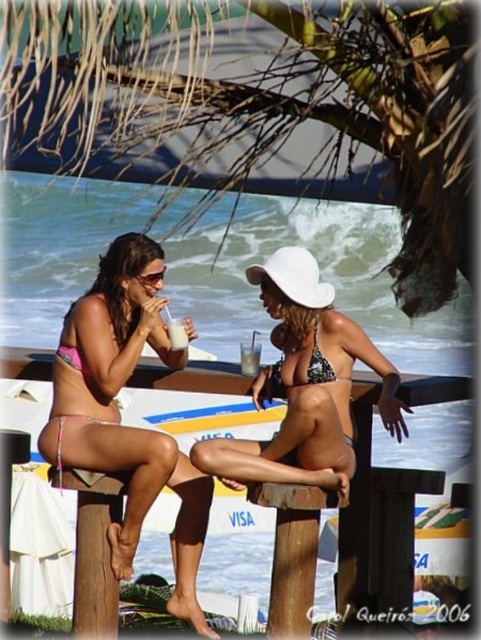
You are standing at the beach and want to place a small flag exactly halfway between point (318, 282) and point (177, 342). Which direction should you walk from the closer point to reach the halfway point?

Since point (318, 282) is closer to the viewer than point (177, 342), you should walk towards the direction of point (177, 342) to reach the halfway point between them.

You are a photographer at the beach and want to capture both the printed bikini at center and the white frothy drink at center in the same frame. Which object should you focus on first if you want to ensure both are in focus?

The printed bikini at center is taller than the white frothy drink at center, so focusing on the taller object first will help ensure both are in focus.